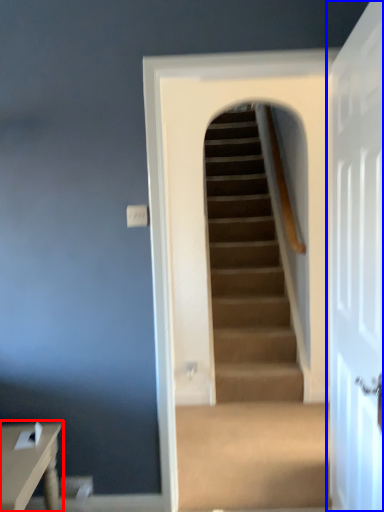
Question: Which point is closer to the camera, table (highlighted by a red box) or door (highlighted by a blue box)?

Choices:
 (A) table
 (B) door

Answer: (B)